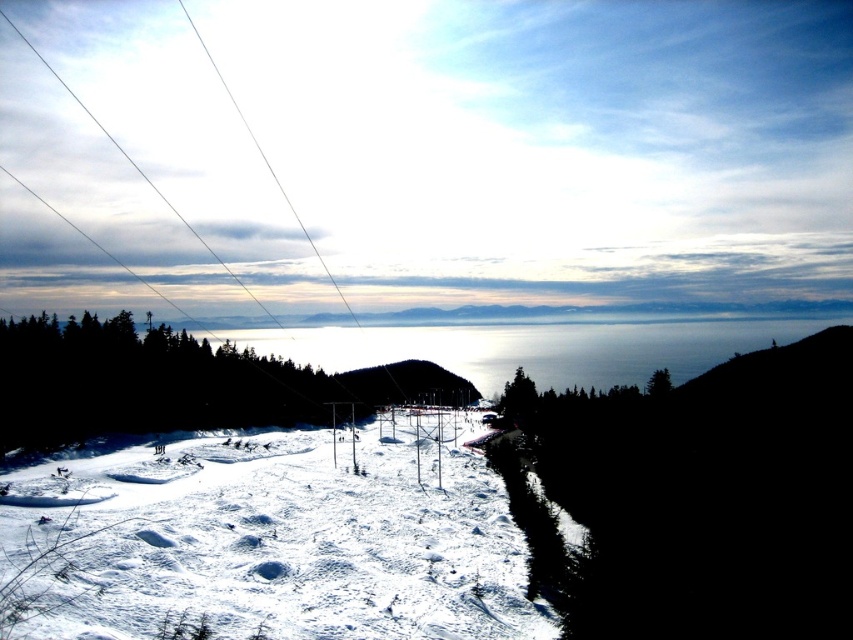
Question: Which of the following is the farthest from the observer?

Choices:
 (A) (219, 513)
 (B) (811, 468)

Answer: (A)

Question: Can you confirm if white powdery snow at center is wider than black matte hill at lower right?

Choices:
 (A) yes
 (B) no

Answer: (B)

Question: Can you confirm if white powdery snow at center is wider than black matte hill at lower right?

Choices:
 (A) yes
 (B) no

Answer: (B)

Question: Which point is closer to the camera taking this photo?

Choices:
 (A) (309, 580)
 (B) (729, 388)

Answer: (A)

Question: Is white powdery snow at center wider than black matte hill at lower right?

Choices:
 (A) yes
 (B) no

Answer: (B)